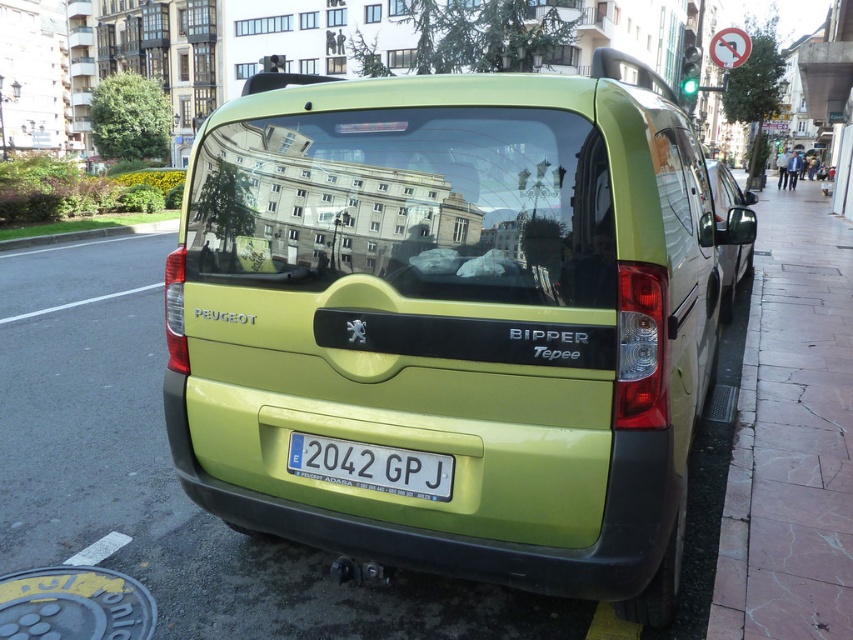
Consider the image. Can you confirm if lime matte van at center is positioned below green matte van at right?

Indeed, lime matte van at center is positioned under green matte van at right.

Is point (254, 100) behind point (727, 195)?

No, it is not.

Where is `lime matte van at center`? lime matte van at center is located at coordinates (453, 321).

Is point (450, 472) in front of point (727, 182)?

Yes.

Can you confirm if white plastic license plate at center is wider than green matte van at right?

No, white plastic license plate at center is not wider than green matte van at right.

Locate an element on the screen. The image size is (853, 640). white plastic license plate at center is located at coordinates (370, 465).

Can you confirm if lime matte van at center is taller than white plastic license plate at center?

Correct, lime matte van at center is much taller as white plastic license plate at center.

How distant is lime matte van at center from white plastic license plate at center?

lime matte van at center and white plastic license plate at center are 8.83 feet apart from each other.

Find the location of a particular element. This screenshot has height=640, width=853. lime matte van at center is located at coordinates point(453,321).